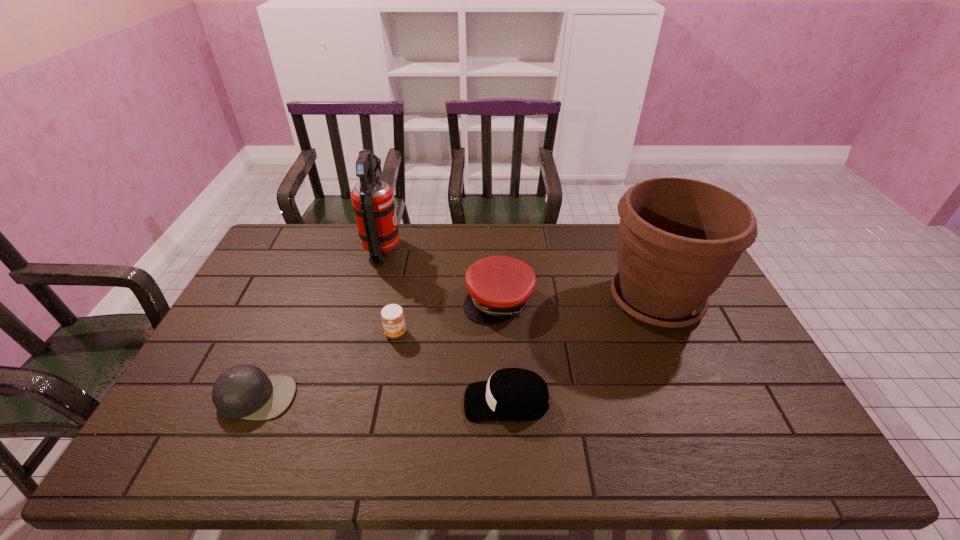
Where is `fire extinguisher`? The width and height of the screenshot is (960, 540). fire extinguisher is located at coordinates (372, 198).

This screenshot has height=540, width=960. Identify the location of the rightmost object. (678, 239).

In order to click on the farthest cap in this screenshot , I will do `click(499, 287)`.

The image size is (960, 540). In order to click on the fourth object from right to left in this screenshot , I will do `click(392, 316)`.

Locate an element on the screen. The image size is (960, 540). the leftmost object is located at coordinates (244, 391).

You are a GUI agent. You are given a task and a screenshot of the screen. Output one action in this format:
    pyautogui.click(x=<x>, y=<y>)
    Task: Click on the vacant area situated on the front label side of the fire extinguisher
    The height and width of the screenshot is (540, 960).
    Given the screenshot: What is the action you would take?
    pyautogui.click(x=452, y=251)

This screenshot has width=960, height=540. I want to click on free space located on the left of the flowerpot, so click(x=552, y=300).

Image resolution: width=960 pixels, height=540 pixels. What are the coordinates of `vacant space situated 0.210m at the front of the farthest cap where the visor is located` in the screenshot? It's located at (503, 385).

This screenshot has width=960, height=540. Identify the location of vacant area situated 0.060m on the front label of the jam. (391, 358).

You are a GUI agent. You are given a task and a screenshot of the screen. Output one action in this format:
    pyautogui.click(x=<x>, y=<y>)
    Task: Click on the vacant space located on the brim of the leftmost cap
    Image resolution: width=960 pixels, height=540 pixels.
    Given the screenshot: What is the action you would take?
    pyautogui.click(x=228, y=461)